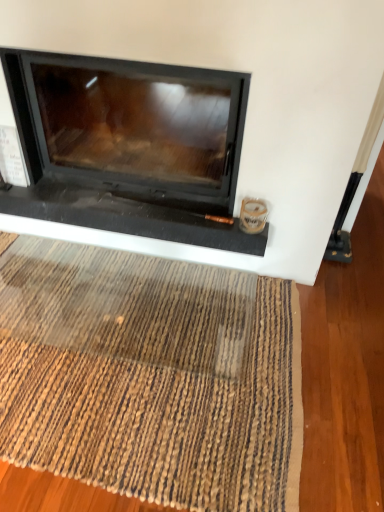
Question: From the image's perspective, is brown woven mat at lower center located above or below black glass fireplace at center?

Choices:
 (A) above
 (B) below

Answer: (B)

Question: From a real-world perspective, relative to black glass fireplace at center, is brown woven mat at lower center vertically above or below?

Choices:
 (A) above
 (B) below

Answer: (B)

Question: Is brown woven mat at lower center bigger or smaller than black glass fireplace at center?

Choices:
 (A) small
 (B) big

Answer: (A)

Question: From a real-world perspective, is black glass fireplace at center physically located above or below brown woven mat at lower center?

Choices:
 (A) above
 (B) below

Answer: (A)

Question: Considering the relative positions of black glass fireplace at center and brown woven mat at lower center in the image provided, is black glass fireplace at center to the left or to the right of brown woven mat at lower center?

Choices:
 (A) left
 (B) right

Answer: (B)

Question: Based on their sizes in the image, would you say black glass fireplace at center is bigger or smaller than brown woven mat at lower center?

Choices:
 (A) big
 (B) small

Answer: (A)

Question: Is black glass fireplace at center wider or thinner than brown woven mat at lower center?

Choices:
 (A) thin
 (B) wide

Answer: (A)